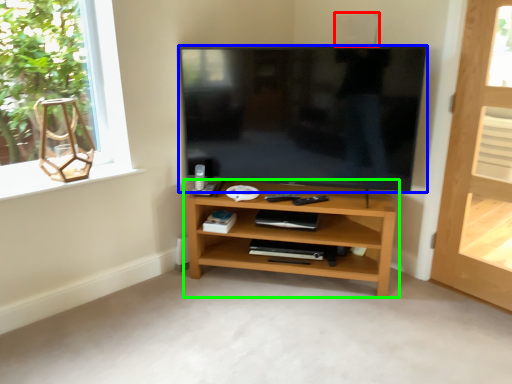
Question: Which is farther away from speaker (highlighted by a red box)? television (highlighted by a blue box) or shelf (highlighted by a green box)?

Choices:
 (A) television
 (B) shelf

Answer: (B)